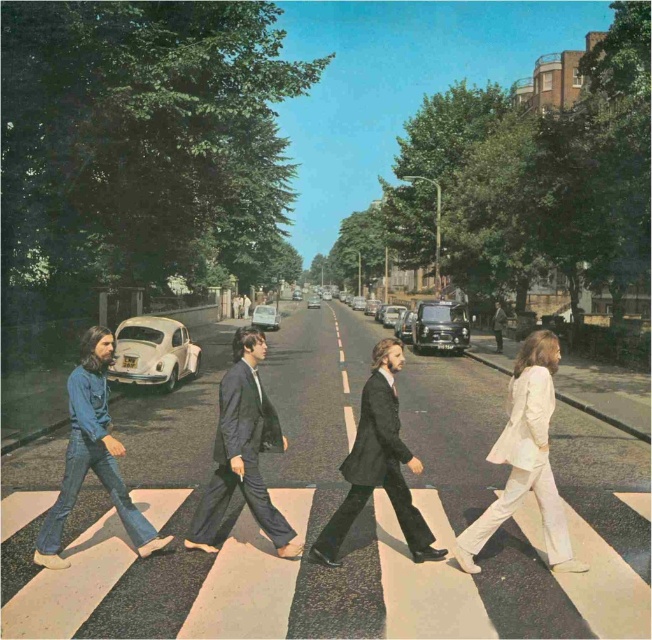
You are a photographer trying to capture a similar shot of the four individuals from the Abbey Road cover. You need to ensure that the dark gray suit at center and the denim jeans at center are positioned correctly. Based on their heights, which individual should be placed behind the other to maintain the perspective seen in the original image?

The dark gray suit at center is not as tall as denim jeans at center. To maintain the perspective, the shorter dark gray suit at center should be placed behind the taller denim jeans at center so that their heights align with the original image.

You are a photographer who wants to capture a similar shot of the two individuals in the center. Which of the two, the dark gray suit at center or the denim jeans at center, should you focus on first if you want to highlight the smaller one?

The dark gray suit at center has a smaller size compared to denim jeans at center, so you should focus on the dark gray suit at center first to highlight the smaller one.

You are a photographer standing on the sidewalk observing the famous Abbey Road crossing. You see two individuals dressed in dark blue suit at center and dark gray suit at center. Which one is closer to you?

The dark blue suit at center is closer to you since it is positioned further to the viewer compared to the dark gray suit at center.